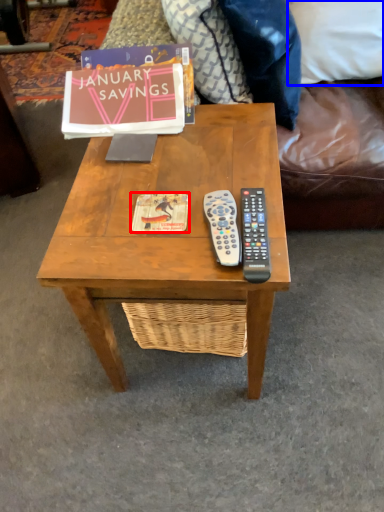
Question: Which object appears farthest to the camera in this image, book cover (highlighted by a red box) or pillow (highlighted by a blue box)?

Choices:
 (A) book cover
 (B) pillow

Answer: (B)